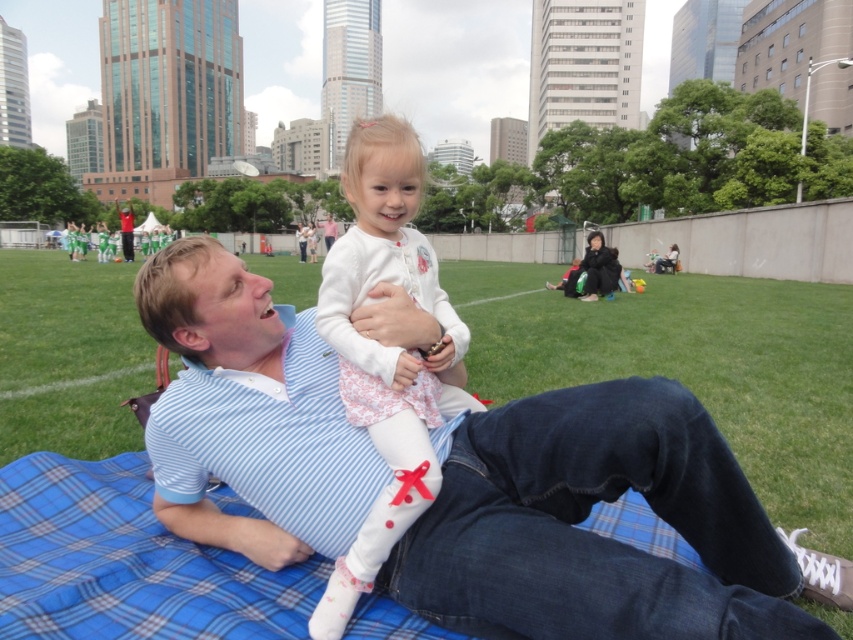
You are a photographer trying to capture the perfect shot of the blue striped shirt at center and the white soft fabric at center. Since you want to emphasize the size difference between them, which object should you place closer to the camera?

To emphasize the size difference between the blue striped shirt at center and the white soft fabric at center, you should place the blue striped shirt at center closer to the camera because it is bigger than the white soft fabric at center.

You are a photographer trying to capture a candid shot of the man and child. You want to ensure the blue striped shirt at center and white soft fabric at center are both visible in the frame. Based on their positions, which object should you focus on first to ensure both are in the shot?

The blue striped shirt at center is below the white soft fabric at center, so focusing on the white soft fabric at center first will ensure the blue striped shirt at center is also captured in the frame.

You are a photographer who wants to capture a closeup of the blue striped shirt at center and white soft fabric at center. Since your camera can only focus on one object at a time, which object should you choose to ensure the other is still partially visible in the frame?

The blue striped shirt at center is wider than the white soft fabric at center. To ensure the white soft fabric at center is partially visible, you should focus on the blue striped shirt at center since it occupies more space and the narrower white soft fabric at center would still be within the frame.